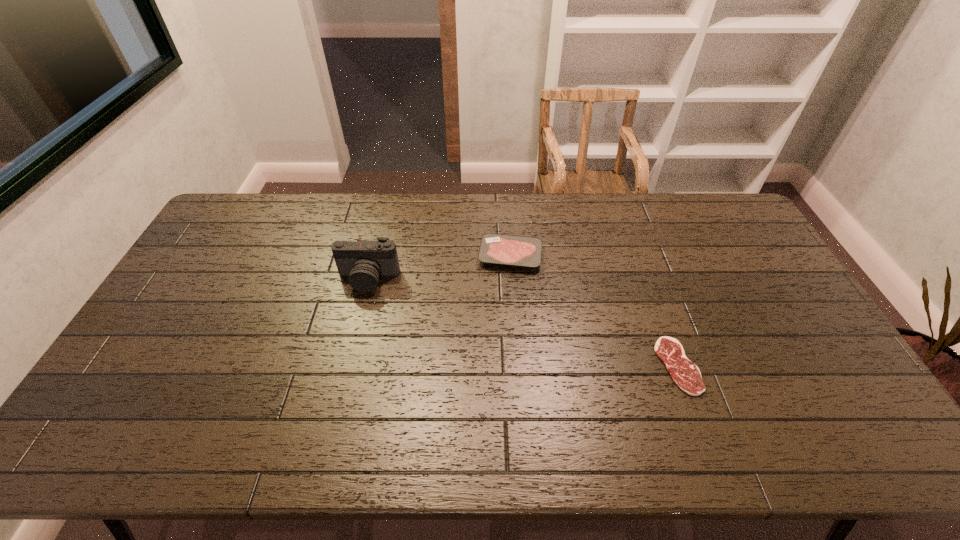
The height and width of the screenshot is (540, 960). I want to click on vacant area that lies between the farther steak and the nearest object, so click(x=594, y=310).

The height and width of the screenshot is (540, 960). I want to click on free space between the nearest object and the leftmost object, so click(523, 322).

This screenshot has width=960, height=540. I want to click on free space between the farther steak and the shorter steak, so click(x=594, y=310).

At what (x,y) coordinates should I click in order to perform the action: click on free point between the leftmost object and the left steak. Please return your answer as a coordinate pair (x, y). Image resolution: width=960 pixels, height=540 pixels. Looking at the image, I should click on (440, 267).

Locate an element on the screen. This screenshot has height=540, width=960. free spot between the camera and the nearer steak is located at coordinates (523, 322).

Where is `the closest object to the shorter steak`? the closest object to the shorter steak is located at coordinates (496, 249).

Point out which object is positioned as the nearest to the leftmost object. Please provide its 2D coordinates. Your answer should be formatted as a tuple, i.e. [(x, y)], where the tuple contains the x and y coordinates of a point satisfying the conditions above.

[(496, 249)]

At what (x,y) coordinates should I click in order to perform the action: click on free region that satisfies the following two spatial constraints: 1. at the lens of the leftmost object; 2. on the left side of the nearest object. Please return your answer as a coordinate pair (x, y). Looking at the image, I should click on (348, 366).

I want to click on vacant space that satisfies the following two spatial constraints: 1. at the lens of the tallest object; 2. on the left side of the nearer steak, so click(x=348, y=366).

Locate an element on the screen. This screenshot has height=540, width=960. vacant area in the image that satisfies the following two spatial constraints: 1. on the front side of the nearer steak; 2. on the left side of the second shortest object is located at coordinates (518, 366).